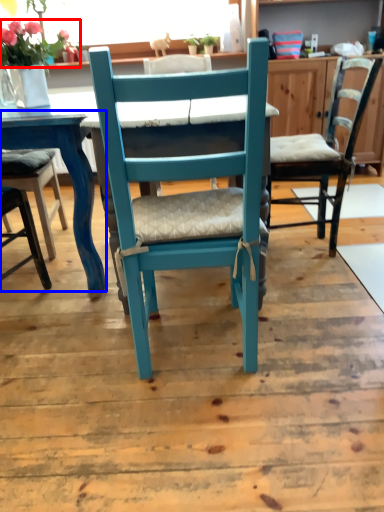
Question: Which object appears closest to the camera in this image, flower (highlighted by a red box) or table (highlighted by a blue box)?

Choices:
 (A) flower
 (B) table

Answer: (B)